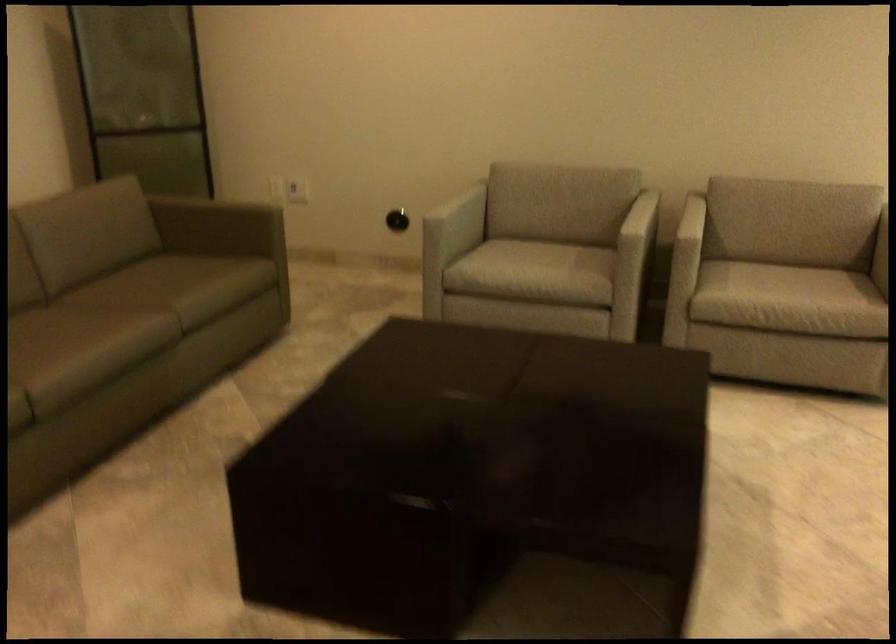
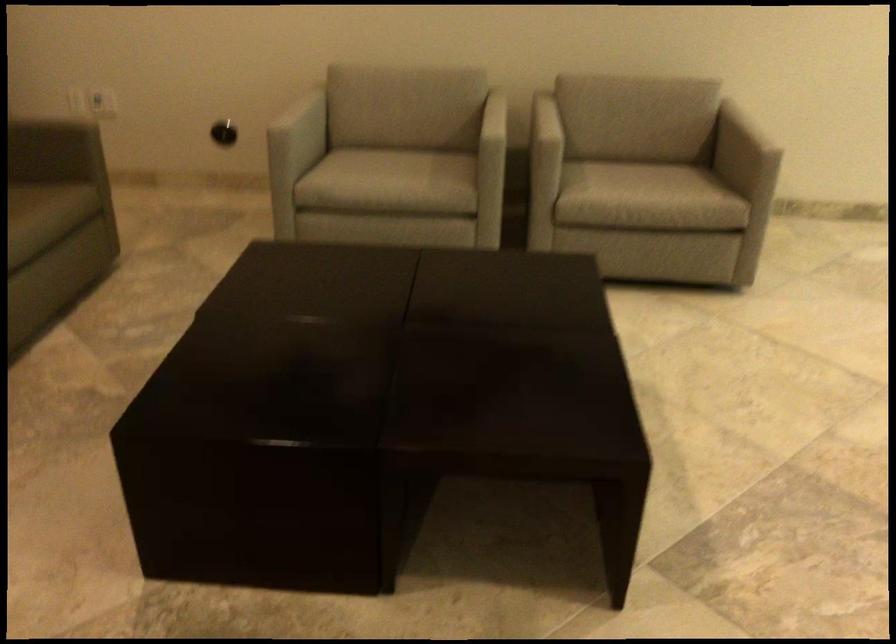
Find the pixel in the second image that matches pixel 460 213 in the first image.

(304, 124)